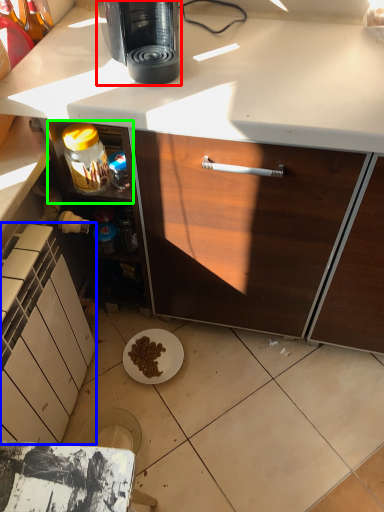
Question: Which object is positioned farthest from coffee maker (highlighted by a red box)? Select from cabinetry (highlighted by a blue box) and shelf (highlighted by a green box).

Choices:
 (A) cabinetry
 (B) shelf

Answer: (A)